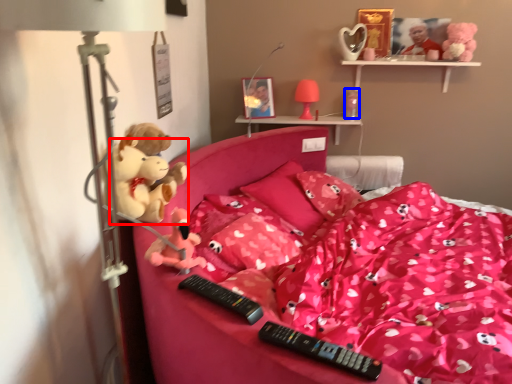
Question: Which object is closer to the camera taking this photo, toy (highlighted by a red box) or toy (highlighted by a blue box)?

Choices:
 (A) toy
 (B) toy

Answer: (A)